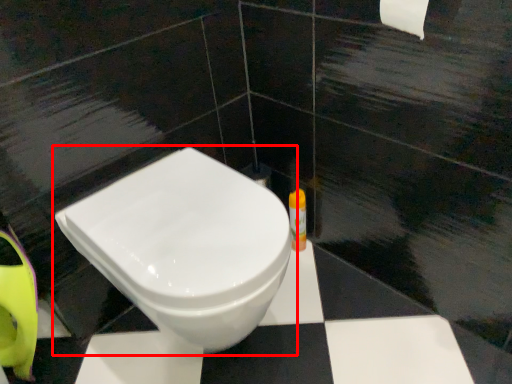
Question: In this image, where is toilet (annotated by the red box) located relative to toiletry?

Choices:
 (A) left
 (B) right

Answer: (A)